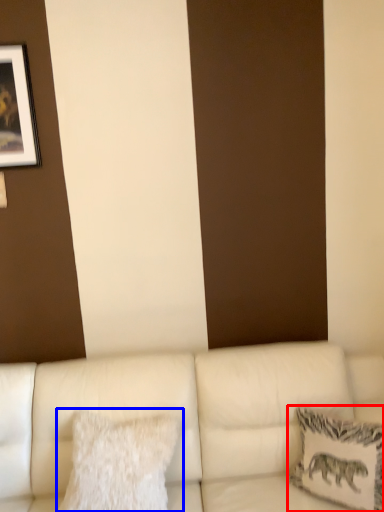
Question: Which of the following is the closest to the observer, pillow (highlighted by a red box) or pillow (highlighted by a blue box)?

Choices:
 (A) pillow
 (B) pillow

Answer: (A)